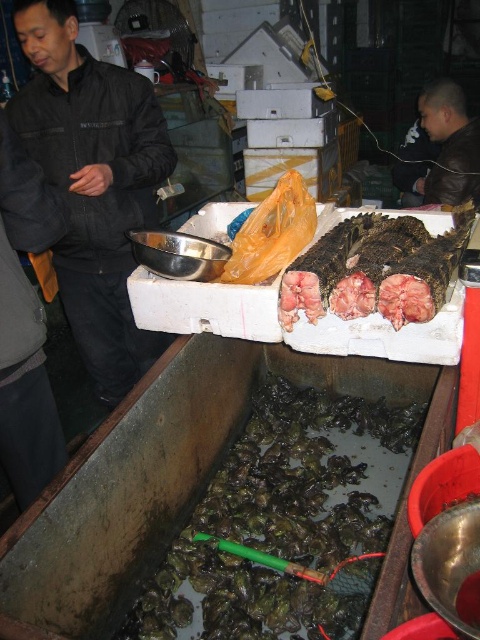
Looking at this image, does dark brown rubber oyster at lower left have a greater height compared to dark brown textured fish at upper center?

Yes, dark brown rubber oyster at lower left is taller than dark brown textured fish at upper center.

Is dark brown rubber oyster at lower left to the right of dark brown textured fish at upper center from the viewer's perspective?

Incorrect, dark brown rubber oyster at lower left is not on the right side of dark brown textured fish at upper center.

Locate an element on the screen. The width and height of the screenshot is (480, 640). dark brown rubber oyster at lower left is located at coordinates (285, 518).

At what (x,y) coordinates should I click in order to perform the action: click on dark brown rubber oyster at lower left. Please return your answer as a coordinate pair (x, y). Looking at the image, I should click on (285, 518).

Who is more forward, (75, 170) or (421, 276)?

Point (421, 276) is more forward.

Which of these two, dark matte jacket at left or dark brown textured fish at upper center, stands shorter?

dark brown textured fish at upper center is shorter.

This screenshot has width=480, height=640. I want to click on dark matte jacket at left, so click(93, 182).

Is dark brown rubber oyster at lower left positioned behind dark matte jacket at left?

No.

In the scene shown: Does dark brown rubber oyster at lower left have a greater width compared to dark matte jacket at left?

Yes.

Which is behind, point (217, 556) or point (39, 45)?

The point (39, 45) is more distant.

Find the location of a particular element. The height and width of the screenshot is (640, 480). dark brown rubber oyster at lower left is located at coordinates (285, 518).